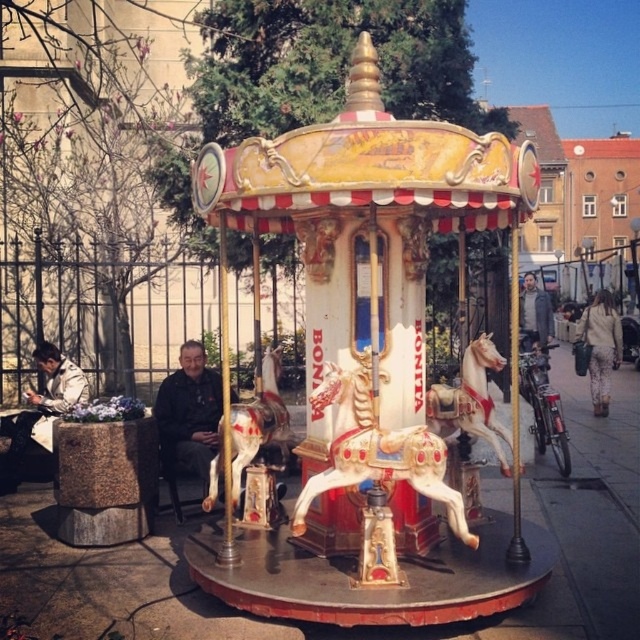
You are a photographer standing in front of the carousel. You want to take a photo that includes both the dark brown leather jacket at center and the white glossy horse at center. Based on their positions, which object should you place on the left side of your photo frame?

The dark brown leather jacket at center should be placed on the left side of your photo frame because it is located to the left of the white glossy horse at center.

You are standing in front of the carousel and see the dark brown leather jacket at center and the white glossy horse at center. Which object is closer to you?

The dark brown leather jacket at center is closer to you because the white glossy horse at center is behind it.